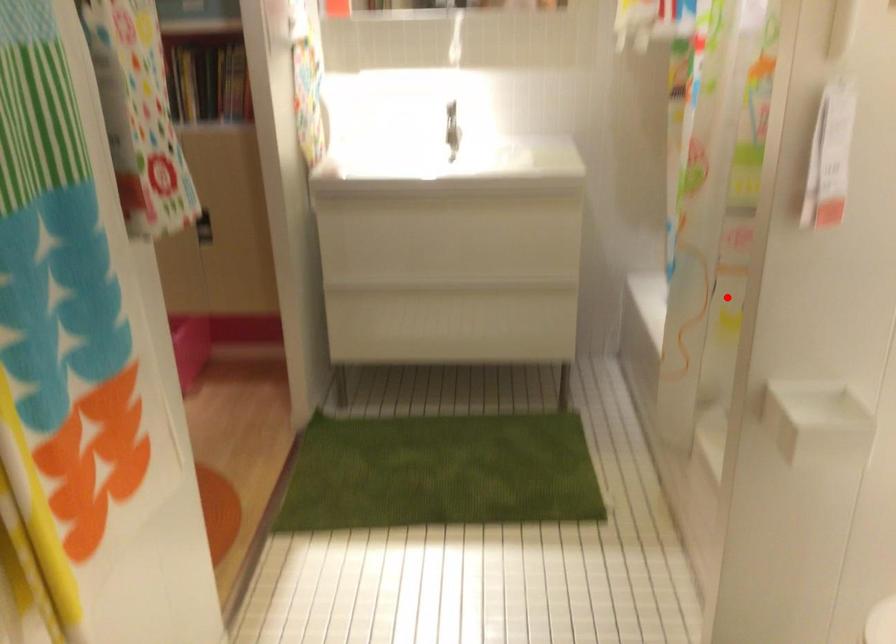
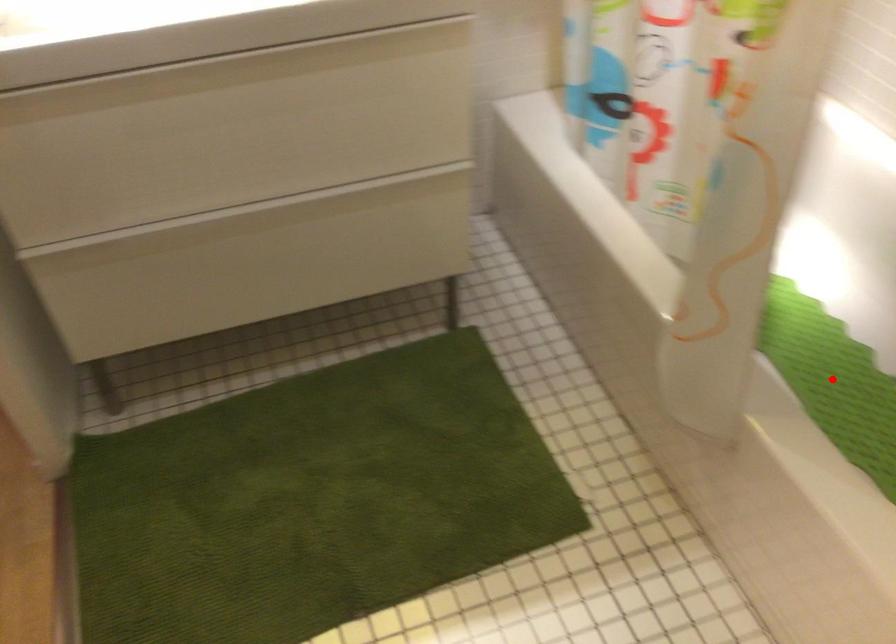
I am providing you with two images of the same scene from different viewpoints. A red point is marked on the first image and another point is marked on the second image. Do the highlighted points in image1 and image2 indicate the same real-world spot?

No